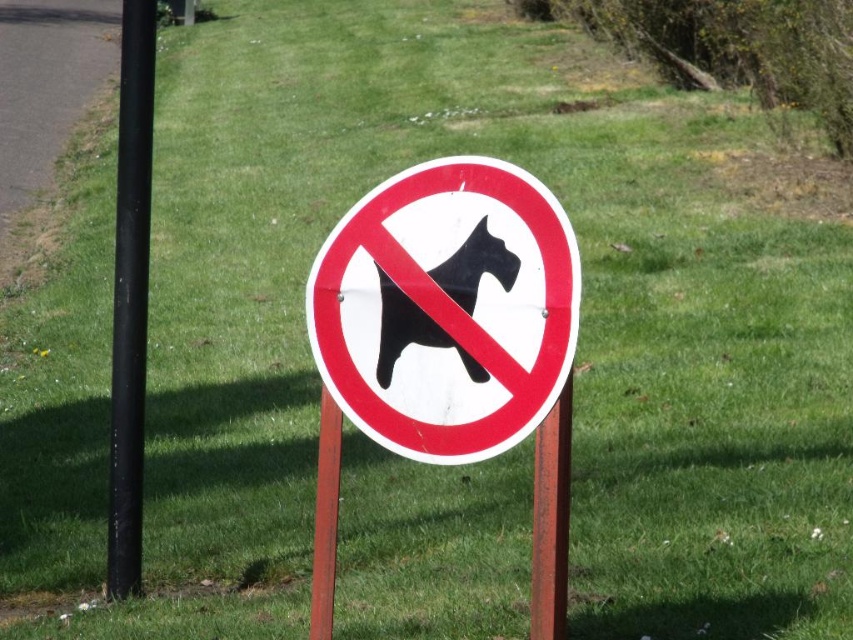
Question: Can you confirm if black matte dog at center is positioned above rusty metal post at center?

Choices:
 (A) no
 (B) yes

Answer: (B)

Question: Among these points, which one is farthest from the camera?

Choices:
 (A) (395, 305)
 (B) (543, 618)
 (C) (462, 424)

Answer: (A)

Question: Does white plastic sign at center have a greater width compared to black metal pole at left?

Choices:
 (A) no
 (B) yes

Answer: (A)

Question: Does black matte dog at center have a lesser width compared to brown wooden post at center?

Choices:
 (A) no
 (B) yes

Answer: (A)

Question: Estimate the real-world distances between objects in this image. Which object is farther from the black matte dog at center?

Choices:
 (A) brown wooden post at center
 (B) white plastic sign at center
 (C) rusty metal post at center

Answer: (A)

Question: Among these objects, which one is farthest from the camera?

Choices:
 (A) brown wooden post at center
 (B) white plastic sign at center
 (C) black metal pole at left
 (D) rusty metal post at center

Answer: (C)